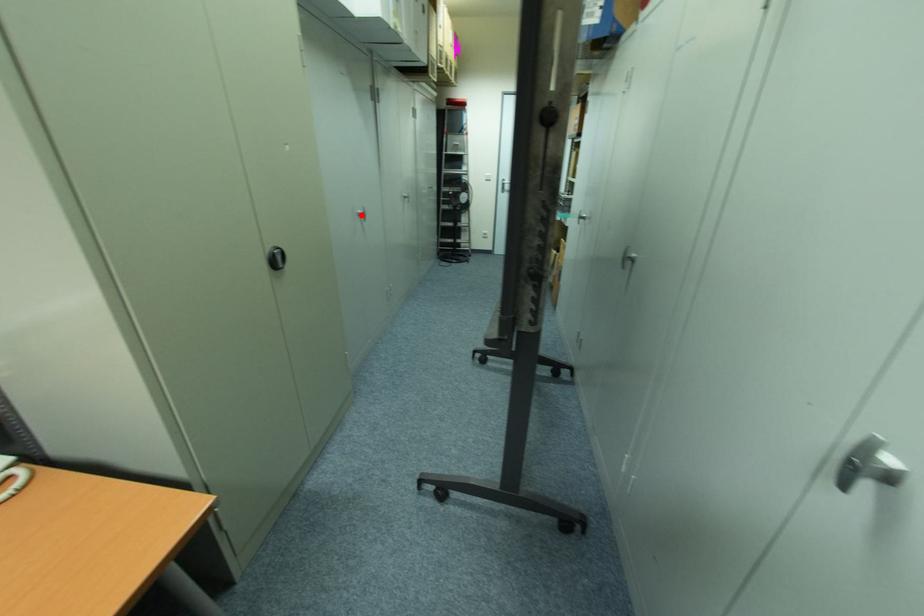
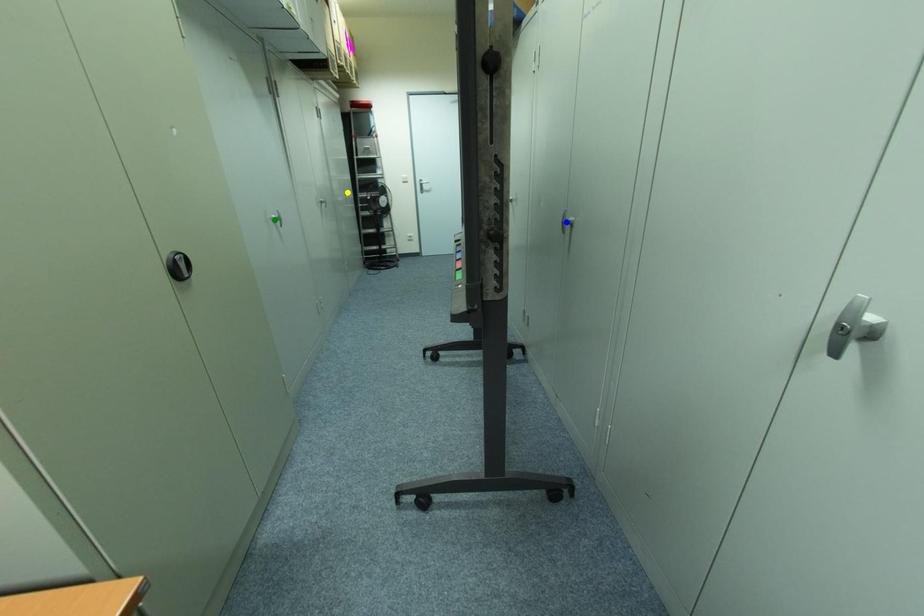
Question: I am providing you with two images of the same scene from different viewpoints. A red point is marked on the first image. You are given multiple points on the second image. In image 2, which mark is for the same physical point as the one in image 1?

Choices:
 (A) green point
 (B) blue point
 (C) yellow point

Answer: (A)